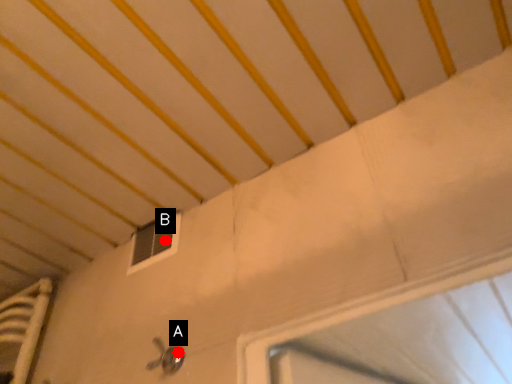
Question: Two points are circled on the image, labeled by A and B beside each circle. Which of the following is the closest to the observer?

Choices:
 (A) A is closer
 (B) B is closer

Answer: (A)